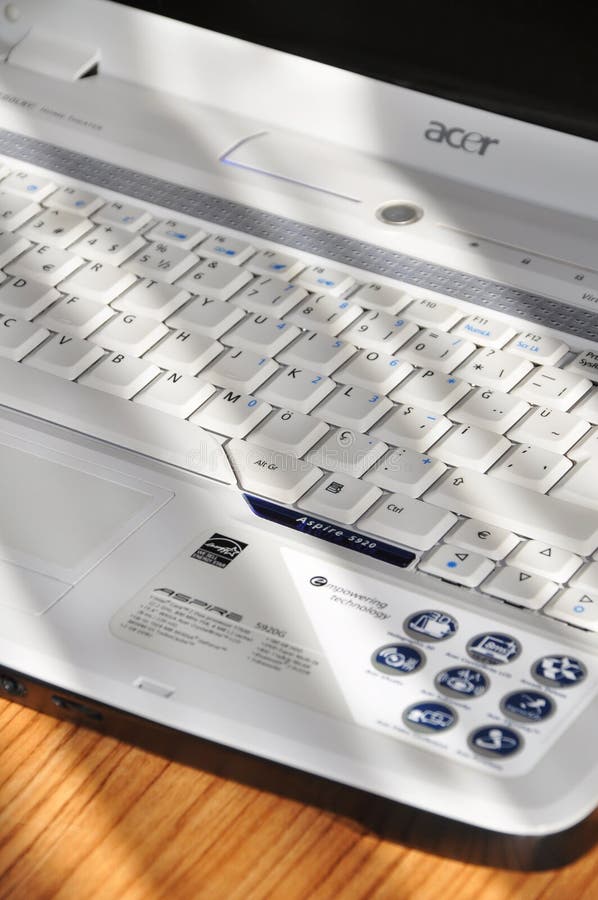
You are a GUI agent. You are given a task and a screenshot of the screen. Output one action in this format:
    pyautogui.click(x=<x>, y=<y>)
    Task: Click on the brand of keyboard
    Image resolution: width=598 pixels, height=900 pixels.
    Given the screenshot: What is the action you would take?
    pyautogui.click(x=460, y=145)